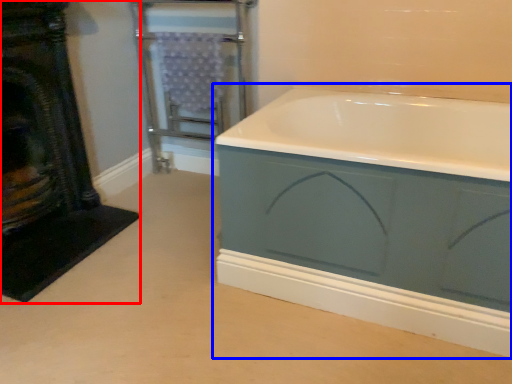
Question: Which object appears closest to the camera in this image, fireplace (highlighted by a red box) or bathtub (highlighted by a blue box)?

Choices:
 (A) fireplace
 (B) bathtub

Answer: (B)